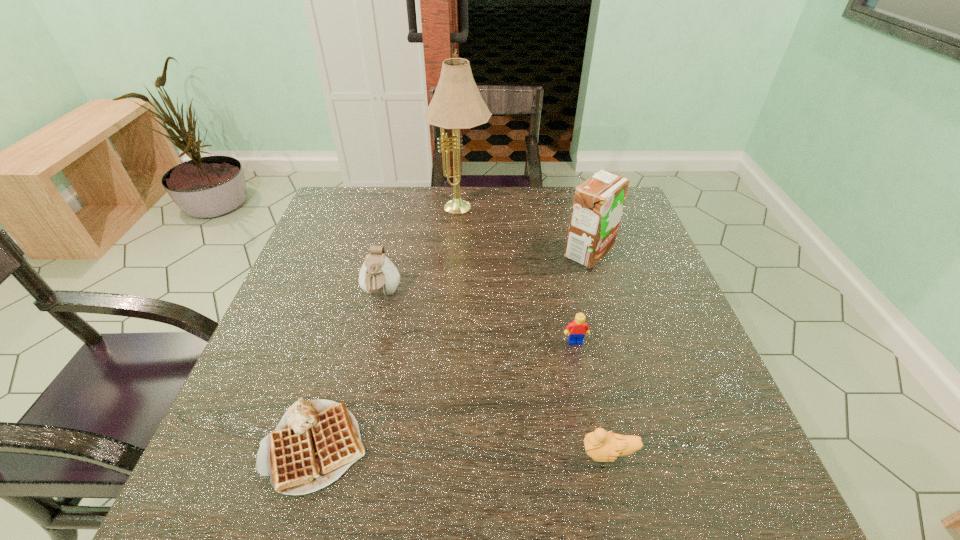
Identify the location of object that can be found as the third closest to the fourth shortest object. Image resolution: width=960 pixels, height=540 pixels. (578, 328).

Where is `free location that satisfies the following two spatial constraints: 1. on the straw side of the second farthest object; 2. on the face of the Lego`? free location that satisfies the following two spatial constraints: 1. on the straw side of the second farthest object; 2. on the face of the Lego is located at coordinates (614, 341).